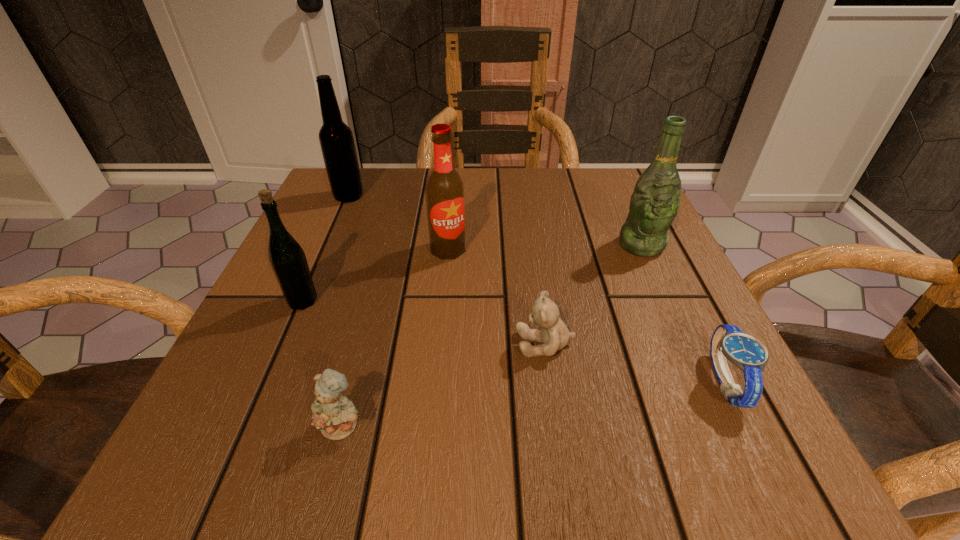
What are the coordinates of `free point at the near right corner` in the screenshot? It's located at coord(724,483).

Identify the location of empty location between the fourth object from left to right and the shortest object. (586, 315).

Image resolution: width=960 pixels, height=540 pixels. I want to click on vacant space that's between the second beer bottle from right to left and the watch, so click(x=586, y=315).

You are a GUI agent. You are given a task and a screenshot of the screen. Output one action in this format:
    pyautogui.click(x=<x>, y=<y>)
    Task: Click on the free space between the left teddy bear and the shortest object
    The width and height of the screenshot is (960, 540).
    Given the screenshot: What is the action you would take?
    pyautogui.click(x=533, y=404)

Where is `vacant area between the fifth object from left to right and the farthest beer bottle`? vacant area between the fifth object from left to right and the farthest beer bottle is located at coordinates (447, 270).

You are a GUI agent. You are given a task and a screenshot of the screen. Output one action in this format:
    pyautogui.click(x=<x>, y=<y>)
    Task: Click on the empty location between the fourth shortest object and the third beer bottle from left to right
    Image resolution: width=960 pixels, height=540 pixels.
    Given the screenshot: What is the action you would take?
    pyautogui.click(x=375, y=275)

Find the location of a particular element. empty space that is in between the left teddy bear and the fourth object from right to left is located at coordinates (396, 338).

You are a GUI agent. You are given a task and a screenshot of the screen. Output one action in this format:
    pyautogui.click(x=<x>, y=<y>)
    Task: Click on the vacant space in between the rightmost beer bottle and the shortest beer bottle
    This screenshot has height=540, width=960.
    Given the screenshot: What is the action you would take?
    pyautogui.click(x=472, y=273)

Find the location of `free space between the farthest object and the fourth object from right to left`. free space between the farthest object and the fourth object from right to left is located at coordinates (398, 222).

In order to click on free space between the nearer teddy bear and the shortest beer bottle in this screenshot , I will do `click(323, 363)`.